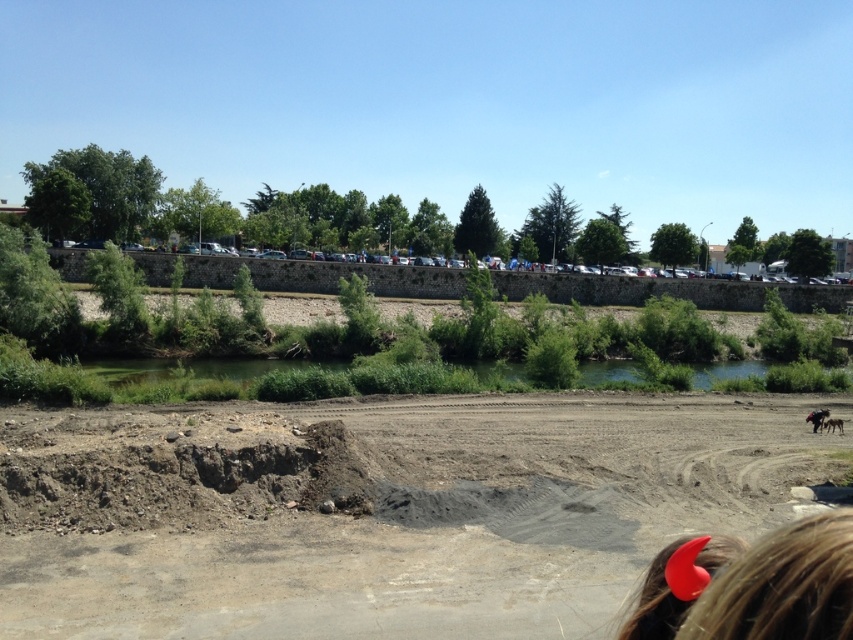
Question: Which object appears closest to the camera in this image?

Choices:
 (A) brown sandy dirt field at center
 (B) green grassy river at center

Answer: (A)

Question: Does brown sandy dirt field at center appear over green grassy river at center?

Choices:
 (A) no
 (B) yes

Answer: (B)

Question: Which object appears closest to the camera in this image?

Choices:
 (A) brown sandy dirt field at center
 (B) green grassy river at center

Answer: (A)

Question: Is brown sandy dirt field at center closer to the viewer compared to green grassy river at center?

Choices:
 (A) yes
 (B) no

Answer: (A)

Question: Is brown sandy dirt field at center to the left of green grassy river at center from the viewer's perspective?

Choices:
 (A) no
 (B) yes

Answer: (B)